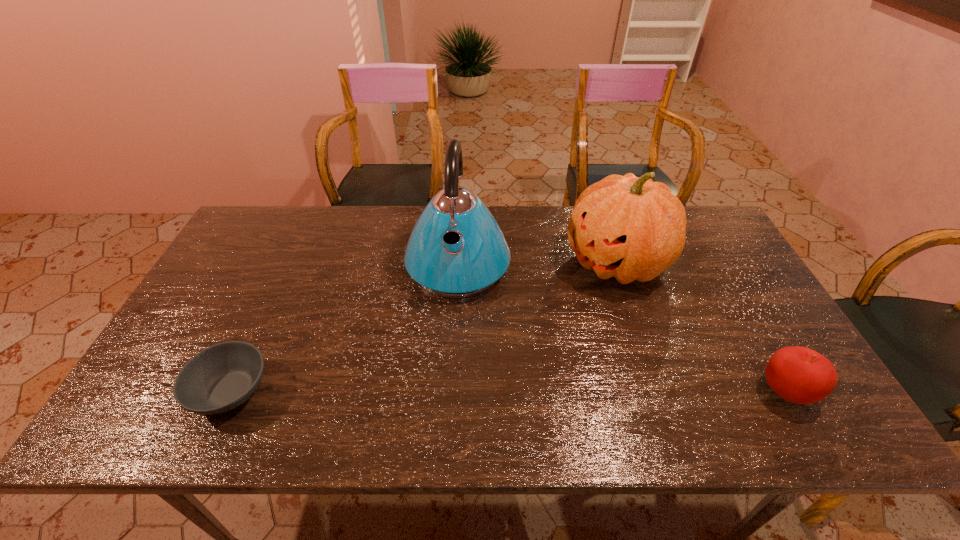
This screenshot has width=960, height=540. Find the location of `the leftmost object`. the leftmost object is located at coordinates (222, 377).

Where is `the shortest object`? The image size is (960, 540). the shortest object is located at coordinates (222, 377).

The image size is (960, 540). Identify the location of the rightmost object. (799, 375).

The width and height of the screenshot is (960, 540). What are the coordinates of `apple` in the screenshot? It's located at (799, 375).

This screenshot has width=960, height=540. In order to click on the second object from left to right in this screenshot , I will do `click(456, 249)`.

You are a GUI agent. You are given a task and a screenshot of the screen. Output one action in this format:
    pyautogui.click(x=<x>, y=<y>)
    Task: Click on the kettle
    The height and width of the screenshot is (540, 960).
    Given the screenshot: What is the action you would take?
    pyautogui.click(x=456, y=249)

The image size is (960, 540). In order to click on pumpkin in this screenshot , I will do `click(631, 228)`.

You are a GUI agent. You are given a task and a screenshot of the screen. Output one action in this format:
    pyautogui.click(x=<x>, y=<y>)
    Task: Click on the third shortest object
    
    Given the screenshot: What is the action you would take?
    pyautogui.click(x=631, y=228)

This screenshot has width=960, height=540. I want to click on free region located on the right of the leftmost object, so click(439, 391).

The height and width of the screenshot is (540, 960). Identify the location of blank space located 0.090m on the left of the apple. (718, 392).